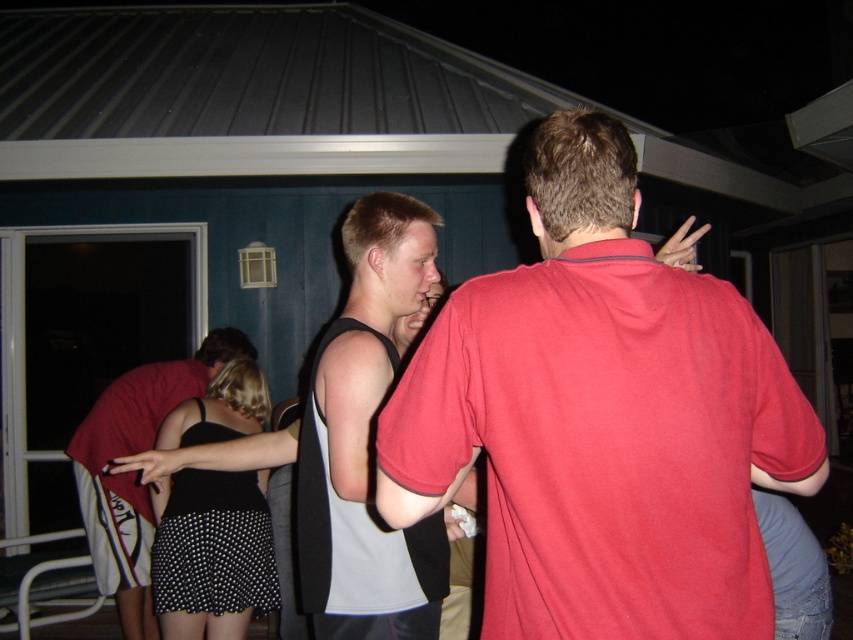
Is matte red shirt at center to the left of black dotted skirt at lower left from the viewer's perspective?

No, matte red shirt at center is not to the left of black dotted skirt at lower left.

Which is above, matte red shirt at center or black dotted skirt at lower left?

matte red shirt at center is above.

Describe the element at coordinates (602, 419) in the screenshot. This screenshot has height=640, width=853. I see `matte red shirt at center` at that location.

I want to click on matte red shirt at center, so click(602, 419).

Which is in front, point (430, 273) or point (115, 445)?

Positioned in front is point (430, 273).

Image resolution: width=853 pixels, height=640 pixels. Describe the element at coordinates (364, 442) in the screenshot. I see `gray matte tank top at center` at that location.

In order to click on gray matte tank top at center in this screenshot , I will do `click(364, 442)`.

Measure the distance between gray matte tank top at center and camera.

5.72 feet

Does gray matte tank top at center have a greater width compared to black dotted skirt at lower left?

No.

Does point (374, 609) come closer to viewer compared to point (163, 627)?

Yes, it is.

Where is `gray matte tank top at center`? gray matte tank top at center is located at coordinates (364, 442).